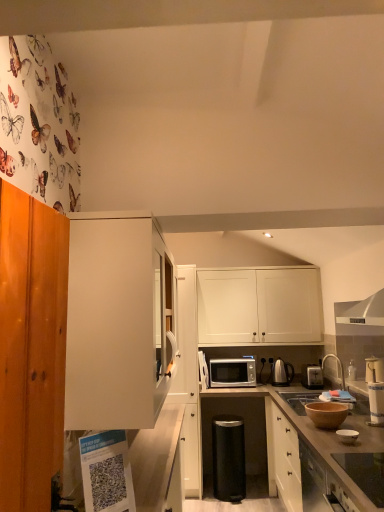
Image resolution: width=384 pixels, height=512 pixels. What do you see at coordinates (327, 414) in the screenshot?
I see `brown matte bowl at lower right` at bounding box center [327, 414].

The image size is (384, 512). Identify the location of brown matte bowl at lower right. (327, 414).

What do you see at coordinates (232, 372) in the screenshot? I see `silver metallic microwave at center` at bounding box center [232, 372].

Measure the distance between wooden at center and camera.

4.99 feet.

At what (x,y) coordinates should I click in order to perform the action: click on wooden at center. Please return your answer as a coordinate pair (x, y). The width and height of the screenshot is (384, 512). Looking at the image, I should click on (299, 440).

This screenshot has width=384, height=512. I want to click on brown matte bowl at lower right, so click(x=327, y=414).

Which object is positioned more to the left, silver metallic microwave at center or black metallic trash can at center, the 5th appliance in the right-to-left sequence?

black metallic trash can at center, the 5th appliance in the right-to-left sequence.

From the image's perspective, is silver metallic microwave at center above black metallic trash can at center, acting as the 1th appliance starting from the left?

Correct, silver metallic microwave at center appears higher than black metallic trash can at center, acting as the 1th appliance starting from the left, in the image.

Considering the points (213, 383) and (241, 439), which point is behind, point (213, 383) or point (241, 439)?

Point (213, 383)

Could you measure the distance between silver metallic microwave at center and black metallic trash can at center, acting as the 1th appliance starting from the left?

The distance of silver metallic microwave at center from black metallic trash can at center, acting as the 1th appliance starting from the left, is 22.24 inches.

Looking at this image, from a real-world perspective, which is physically above, matte white toaster at right, marked as the 1th appliance in a right-to-left arrangement, or wooden at center?

matte white toaster at right, marked as the 1th appliance in a right-to-left arrangement.

From the image's perspective, who appears lower, matte white toaster at right, arranged as the first appliance when viewed from the top, or wooden at center?

wooden at center is shown below in the image.

Who is bigger, matte white toaster at right, arranged as the first appliance when viewed from the top, or wooden at center?

Bigger between the two is wooden at center.

Considering the positions of point (381, 359) and point (380, 504), is point (381, 359) closer or farther from the camera than point (380, 504)?

Point (381, 359) is positioned farther from the camera compared to point (380, 504).

Looking at their sizes, would you say smooth glass cooktop at lower right, which is the 2th appliance from top to bottom, is wider or thinner than white glossy bowl at lower right, which is counted as the fourth appliance, starting from the back?

Considering their sizes, smooth glass cooktop at lower right, which is the 2th appliance from top to bottom, looks broader than white glossy bowl at lower right, which is counted as the fourth appliance, starting from the back.

From a real-world perspective, is smooth glass cooktop at lower right, positioned as the second appliance in left-to-right order, over white glossy bowl at lower right, which is counted as the fourth appliance, starting from the back?

No, from a real-world perspective, smooth glass cooktop at lower right, positioned as the second appliance in left-to-right order, is not over white glossy bowl at lower right, which is counted as the fourth appliance, starting from the back

Is smooth glass cooktop at lower right, positioned as the second appliance in left-to-right order, positioned with its back to white glossy bowl at lower right, the second appliance in the front-to-back sequence?

smooth glass cooktop at lower right, positioned as the second appliance in left-to-right order, does not have its back to white glossy bowl at lower right, the second appliance in the front-to-back sequence.

Starting from the smooth glass cooktop at lower right, arranged as the fifth appliance when viewed from the back, which appliance is the 1st one behind? Please provide its 2D coordinates.

[(347, 436)]

Which of these two, black metallic trash can at center, which is the fifth appliance in top-to-bottom order, or silver metallic faucet at upper right, is smaller?

silver metallic faucet at upper right.

From a real-world perspective, who is located lower, black metallic trash can at center, the 5th appliance in the right-to-left sequence, or silver metallic faucet at upper right?

black metallic trash can at center, the 5th appliance in the right-to-left sequence.

Is black metallic trash can at center, which is the fifth appliance in top-to-bottom order, oriented towards silver metallic faucet at upper right?

No, black metallic trash can at center, which is the fifth appliance in top-to-bottom order, is not oriented towards silver metallic faucet at upper right.

From a real-world perspective, count 4th appliances downward from the silver metallic faucet at upper right and point to it. Please provide its 2D coordinates.

[(228, 458)]

Between wooden at center and black metallic trash can at center, the 4th appliance positioned from the front, which one has more height?

Standing taller between the two is wooden at center.

Is wooden at center closer to camera compared to black metallic trash can at center, acting as the 1th appliance starting from the left?

Yes, it is in front of black metallic trash can at center, acting as the 1th appliance starting from the left.

Based on the photo, measure the distance from wooden at center to black metallic trash can at center, marked as the 1th appliance in a bottom-to-top arrangement.

wooden at center is 17.86 inches away from black metallic trash can at center, marked as the 1th appliance in a bottom-to-top arrangement.

Is wooden at center turned away from black metallic trash can at center, the 4th appliance positioned from the front?

That's right, wooden at center is facing away from black metallic trash can at center, the 4th appliance positioned from the front.

Would you say white glossy bowl at lower right, positioned as the third appliance in bottom-to-top order, is inside or outside silver metallic toaster at right?

white glossy bowl at lower right, positioned as the third appliance in bottom-to-top order, is located beyond the bounds of silver metallic toaster at right.

From a real-world perspective, is white glossy bowl at lower right, marked as the 3th appliance in a right-to-left arrangement, physically below silver metallic toaster at right?

Yes, from a real-world perspective, white glossy bowl at lower right, marked as the 3th appliance in a right-to-left arrangement, is under silver metallic toaster at right.

Which is more to the left, white glossy bowl at lower right, which is counted as the fourth appliance, starting from the back, or silver metallic toaster at right?

From the viewer's perspective, white glossy bowl at lower right, which is counted as the fourth appliance, starting from the back, appears more on the left side.

Is silver metallic toaster at right to the left of brown matte bowl at lower right from the viewer's perspective?

No.

From a real-world perspective, is silver metallic toaster at right above or below brown matte bowl at lower right?

In terms of real-world spatial position, silver metallic toaster at right is above brown matte bowl at lower right.

Would you say silver metallic toaster at right is inside or outside brown matte bowl at lower right?

silver metallic toaster at right is located beyond the bounds of brown matte bowl at lower right.

This screenshot has width=384, height=512. I want to click on appliance below the silver metallic microwave at center (from the image's perspective), so click(228, 458).

You are a GUI agent. You are given a task and a screenshot of the screen. Output one action in this format:
    pyautogui.click(x=<x>, y=<y>)
    Task: Click on the 1st appliance behind the wooden at center, starting your count from the anchor
    This screenshot has height=512, width=384.
    Given the screenshot: What is the action you would take?
    pyautogui.click(x=374, y=369)

Consider the image. Considering their positions, is matte white toaster at right, arranged as the first appliance when viewed from the top, positioned further to metallic electric kettle at center-right, positioned as the 5th appliance in front-to-back order, than white glossy bowl at lower right, the second appliance in the front-to-back sequence?

Among the two, white glossy bowl at lower right, the second appliance in the front-to-back sequence, is located further to metallic electric kettle at center-right, positioned as the 5th appliance in front-to-back order.

Considering their positions, is matte white toaster at right, which is counted as the 5th appliance, starting from the bottom, positioned closer to silver metallic toaster at right than wooden at center?

matte white toaster at right, which is counted as the 5th appliance, starting from the bottom, is closer to silver metallic toaster at right.

Which object lies nearer to the anchor point metallic electric kettle at center-right, the second appliance from the bottom, silver metallic faucet at upper right or wooden at center?

silver metallic faucet at upper right is positioned closer to the anchor metallic electric kettle at center-right, the second appliance from the bottom.

From the image, which object appears to be farther from white matte cabinet at upper center, placed as the third cabinetry when sorted from front to back, silver metallic microwave at center or silver metallic faucet at upper right?

Based on the image, silver metallic faucet at upper right appears to be further to white matte cabinet at upper center, placed as the third cabinetry when sorted from front to back.

Looking at the image, which one is located closer to black metallic trash can at center, marked as the 1th appliance in a bottom-to-top arrangement, white matte cabinet at center, the second cabinetry in the front-to-back sequence, or silver metallic microwave at center?

white matte cabinet at center, the second cabinetry in the front-to-back sequence, lies closer to black metallic trash can at center, marked as the 1th appliance in a bottom-to-top arrangement, than the other object.

From the image, which object appears to be nearer to white glossy bowl at lower right, marked as the 3th appliance in a right-to-left arrangement, brown matte bowl at lower right or silver metallic faucet at upper right?

brown matte bowl at lower right.

Looking at the image, which one is located closer to wooden at center, black metallic trash can at center, which is the fifth appliance in top-to-bottom order, or brown matte bowl at lower right?

black metallic trash can at center, which is the fifth appliance in top-to-bottom order, lies closer to wooden at center than the other object.

Based on their spatial positions, is matte white toaster at right, marked as the third appliance in a front-to-back arrangement, or white matte cabinet at center, which appears as the first cabinetry when viewed from the left, closer to black metallic trash can at center, the 4th appliance positioned from the front?

matte white toaster at right, marked as the third appliance in a front-to-back arrangement, lies closer to black metallic trash can at center, the 4th appliance positioned from the front, than the other object.

What are the coordinates of `tap located between white glossy bowl at lower right, the 3th appliance when ordered from top to bottom, and silver metallic microwave at center in the depth direction` in the screenshot? It's located at (339, 364).

Image resolution: width=384 pixels, height=512 pixels. I want to click on cabinetry between white matte cabinet at center, the 2th cabinetry viewed from the left, and matte white toaster at right, which is counted as the 5th appliance, starting from the bottom, from left to right, so click(x=258, y=306).

This screenshot has width=384, height=512. Find the location of `countertop between white matte cabinet at center, which appears as the first cabinetry when viewed from the left, and black metallic trash can at center, acting as the 1th appliance starting from the left, from front to back`. countertop between white matte cabinet at center, which appears as the first cabinetry when viewed from the left, and black metallic trash can at center, acting as the 1th appliance starting from the left, from front to back is located at coordinates (299, 440).

The height and width of the screenshot is (512, 384). I want to click on tap positioned between smooth glass cooktop at lower right, which is the 2th appliance from top to bottom, and black metallic trash can at center, the 5th appliance in the right-to-left sequence, from near to far, so click(339, 364).